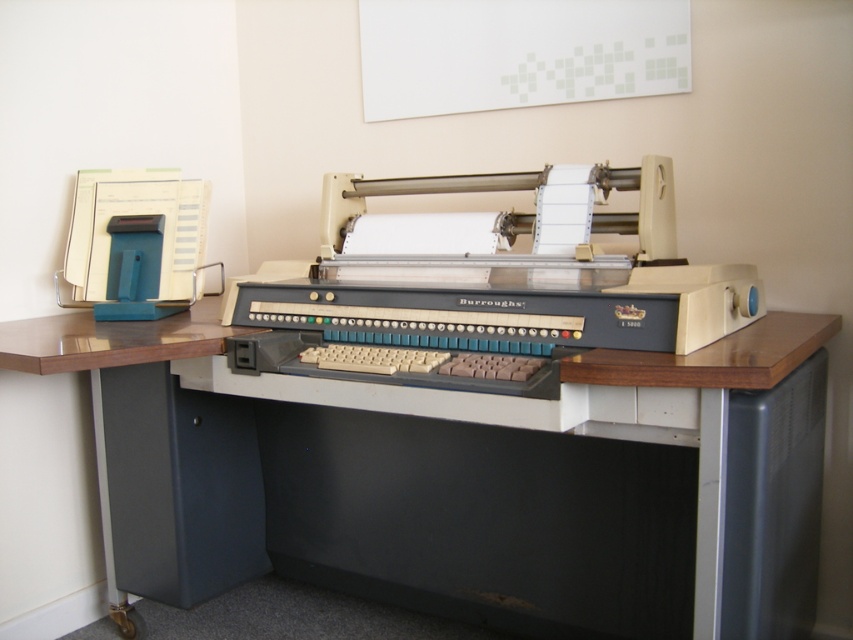
Question: Is wooden desk at center wider than beige plastic printer at center?

Choices:
 (A) no
 (B) yes

Answer: (B)

Question: Among these objects, which one is nearest to the camera?

Choices:
 (A) wooden desk at center
 (B) beige plastic printer at center

Answer: (A)

Question: Is wooden desk at center above beige plastic printer at center?

Choices:
 (A) yes
 (B) no

Answer: (B)

Question: Is the position of wooden desk at center less distant than that of beige plastic printer at center?

Choices:
 (A) yes
 (B) no

Answer: (A)

Question: Which point is farther to the camera?

Choices:
 (A) beige plastic printer at center
 (B) wooden desk at center

Answer: (A)